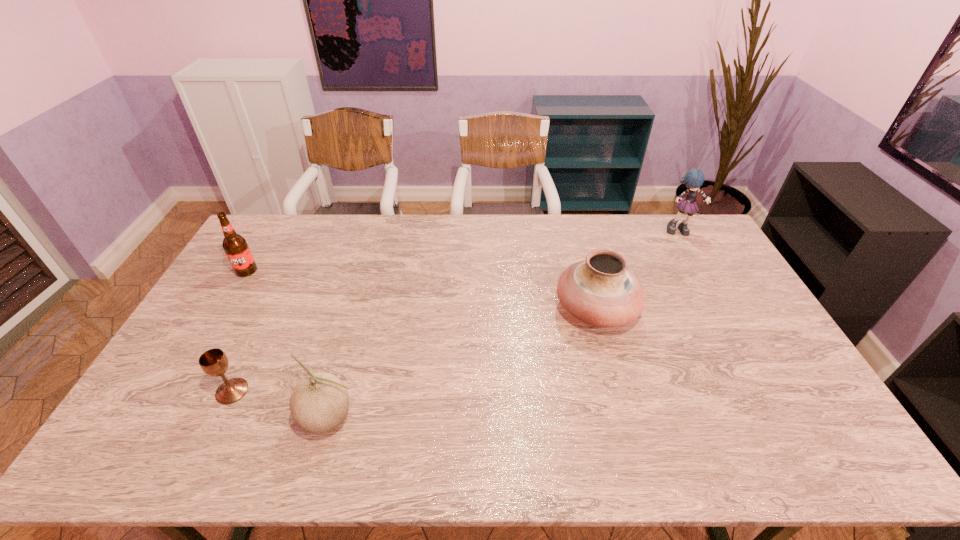
Where is `vacant region located on the back of the root beer`? vacant region located on the back of the root beer is located at coordinates (266, 239).

Identify the location of free region located 0.230m on the back of the third farthest object. (577, 241).

Find the location of `vacant space situated on the back of the cantaloup`. vacant space situated on the back of the cantaloup is located at coordinates (364, 296).

Find the location of `free space located 0.080m on the front of the chalice`. free space located 0.080m on the front of the chalice is located at coordinates (212, 433).

Locate an element on the screen. object that is at the far edge is located at coordinates (693, 180).

Locate an element on the screen. This screenshot has width=960, height=540. object at the near edge is located at coordinates click(319, 403).

Locate an element on the screen. This screenshot has width=960, height=540. object at the left edge is located at coordinates (235, 246).

What are the coordinates of `object that is positioned at the right edge` in the screenshot? It's located at (693, 180).

This screenshot has height=540, width=960. What are the coordinates of `object situated at the far right corner` in the screenshot? It's located at (693, 180).

The width and height of the screenshot is (960, 540). In the image, there is a desktop. In order to click on vacant space at the far edge in this screenshot , I will do `click(610, 238)`.